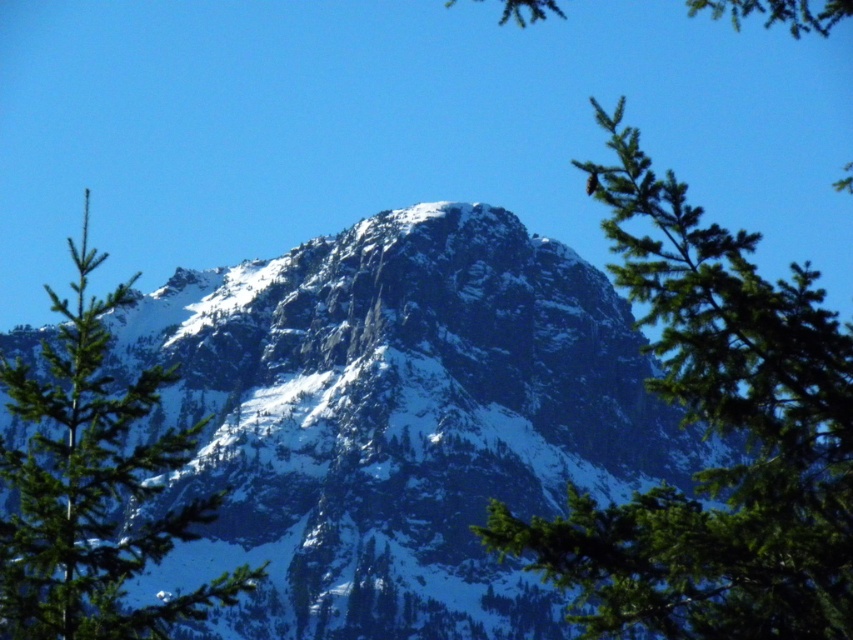
Question: Can you confirm if green needle-like branches at center is thinner than green matte tree at center?

Choices:
 (A) no
 (B) yes

Answer: (A)

Question: Which point is farther to the camera?

Choices:
 (A) (119, 596)
 (B) (560, 340)
 (C) (798, 292)

Answer: (B)

Question: Among these points, which one is nearest to the camera?

Choices:
 (A) (451, 502)
 (B) (253, 579)

Answer: (B)

Question: Can you confirm if white rocky mountain at center is positioned above green needle-like branches at center?

Choices:
 (A) yes
 (B) no

Answer: (B)

Question: Can you confirm if white rocky mountain at center is positioned to the right of green matte tree at center?

Choices:
 (A) yes
 (B) no

Answer: (A)

Question: Which point is closer to the camera?

Choices:
 (A) green matte tree at center
 (B) white rocky mountain at center

Answer: (A)